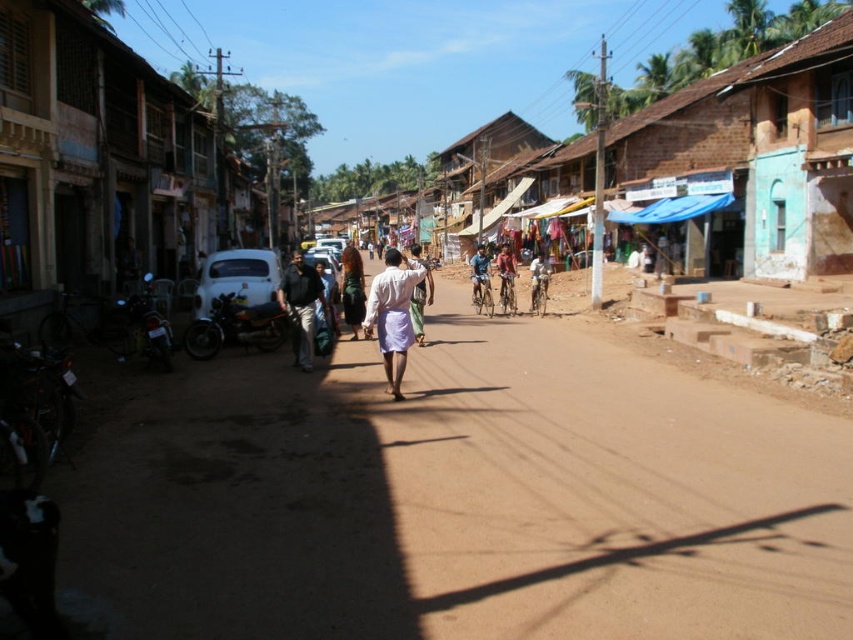
Question: Which is nearer to the shiny black motorcycle at left?

Choices:
 (A) dark brown hair at center
 (B) white cotton shirt at center

Answer: (A)

Question: Is light brown fabric shirt at center positioned behind metallic silver bicycle at center?

Choices:
 (A) no
 (B) yes

Answer: (A)

Question: Considering the relative positions of white cotton cloth at center and dark brown hair at center in the image provided, where is white cotton cloth at center located with respect to dark brown hair at center?

Choices:
 (A) left
 (B) right

Answer: (B)

Question: Which of the following is the closest to the observer?

Choices:
 (A) blue fabric shirt at center
 (B) rusty brick building at right
 (C) shiny black motorcycle at center-left
 (D) metallic silver bicycle at center

Answer: (C)

Question: Is white painted wood hut at left thinner than metallic silver bicycle at center?

Choices:
 (A) no
 (B) yes

Answer: (A)

Question: Estimate the real-world distances between objects in this image. Which object is farther from the dark brown hair at center?

Choices:
 (A) metallic silver bicycle at center
 (B) blue fabric shirt at center

Answer: (A)